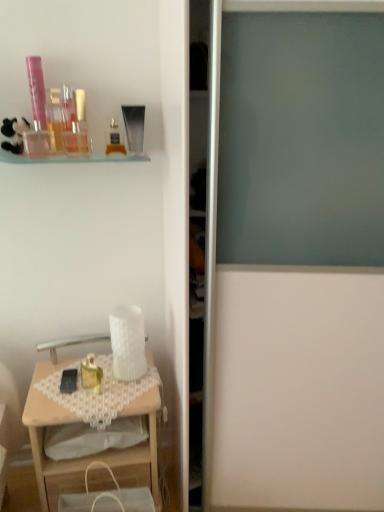
Identify the location of wooden desk at lower left. (87, 456).

Measure the distance between translucent glass perfume bottle at upper center, the 6th toiletry positioned from the top, and camera.

translucent glass perfume bottle at upper center, the 6th toiletry positioned from the top, and camera are 1.39 meters apart.

This screenshot has width=384, height=512. Identify the location of translucent glass perfume bottle at upper center, the 6th toiletry positioned from the top. (114, 139).

Where is `black matte mobile phone at lower left`? Image resolution: width=384 pixels, height=512 pixels. black matte mobile phone at lower left is located at coordinates (69, 381).

The image size is (384, 512). What are the coordinates of `white fabric handbag at lower left` in the screenshot? It's located at (107, 497).

Measure the distance between clear plastic bottle at upper left, marked as the second toiletry in a top-to-bottom arrangement, and camera.

A distance of 4.36 feet exists between clear plastic bottle at upper left, marked as the second toiletry in a top-to-bottom arrangement, and camera.

The width and height of the screenshot is (384, 512). What are the coordinates of `wooden desk at lower left` in the screenshot? It's located at (87, 456).

Is matte gold perfume at upper left, which is counted as the third toiletry, starting from the top, with matte plastic perfume bottle at upper left, placed as the seventh toiletry when sorted from top to bottom?

No.

From the image's perspective, which one is positioned higher, matte gold perfume at upper left, which is counted as the third toiletry, starting from the top, or matte plastic perfume bottle at upper left, placed as the seventh toiletry when sorted from top to bottom?

matte gold perfume at upper left, which is counted as the third toiletry, starting from the top, appears higher in the image.

Is matte gold perfume at upper left, which is the 6th toiletry from bottom to top, positioned with its back to matte plastic perfume bottle at upper left, placed as the seventh toiletry when sorted from top to bottom?

matte gold perfume at upper left, which is the 6th toiletry from bottom to top, is not turned away from matte plastic perfume bottle at upper left, placed as the seventh toiletry when sorted from top to bottom.

Is matte plastic perfume bottle at upper left, the 2th toiletry when ordered from bottom to top, located within matte gold perfume at upper left, which is counted as the third toiletry, starting from the top?

No, matte plastic perfume bottle at upper left, the 2th toiletry when ordered from bottom to top, is not a part of matte gold perfume at upper left, which is counted as the third toiletry, starting from the top.

Considering the relative sizes of pink plastic tube at upper left, which is the 8th toiletry from bottom to top, and matte plastic perfume bottle at upper left, the 2th toiletry when ordered from bottom to top, in the image provided, is pink plastic tube at upper left, which is the 8th toiletry from bottom to top, thinner than matte plastic perfume bottle at upper left, the 2th toiletry when ordered from bottom to top,?

Yes.

Who is shorter, pink plastic tube at upper left, which is the 8th toiletry from bottom to top, or matte plastic perfume bottle at upper left, placed as the seventh toiletry when sorted from top to bottom?

Standing shorter between the two is matte plastic perfume bottle at upper left, placed as the seventh toiletry when sorted from top to bottom.

How many degrees apart are the facing directions of pink plastic tube at upper left, which is the first toiletry in top-to-bottom order, and matte plastic perfume bottle at upper left, placed as the seventh toiletry when sorted from top to bottom?

There is a 4.36-degree angle between the facing directions of pink plastic tube at upper left, which is the first toiletry in top-to-bottom order, and matte plastic perfume bottle at upper left, placed as the seventh toiletry when sorted from top to bottom.

In the scene shown: From a real-world perspective, does pink plastic tube at upper left, which is the first toiletry in top-to-bottom order, stand above matte plastic perfume bottle at upper left, the 2th toiletry when ordered from bottom to top?

Yes, from a real-world perspective, pink plastic tube at upper left, which is the first toiletry in top-to-bottom order, is on top of matte plastic perfume bottle at upper left, the 2th toiletry when ordered from bottom to top.

Is black matte mobile phone at lower left looking in the opposite direction of matte gold perfume at upper left, which is the 6th toiletry from bottom to top?

No, black matte mobile phone at lower left's orientation is not away from matte gold perfume at upper left, which is the 6th toiletry from bottom to top.

Can you confirm if black matte mobile phone at lower left is bigger than matte gold perfume at upper left, which is counted as the third toiletry, starting from the top?

No.

Considering the sizes of objects black matte mobile phone at lower left and matte gold perfume at upper left, which is counted as the third toiletry, starting from the top, in the image provided, who is shorter, black matte mobile phone at lower left or matte gold perfume at upper left, which is counted as the third toiletry, starting from the top,?

Standing shorter between the two is black matte mobile phone at lower left.

From a real-world perspective, which object rests below the other?

From a 3D spatial view, black matte mobile phone at lower left is below.

Is point (68, 385) less distant than point (118, 140)?

That is False.

Is black matte mobile phone at lower left in contact with translucent glass perfume bottle at upper center, which is counted as the third toiletry, starting from the bottom?

No, black matte mobile phone at lower left is not next to translucent glass perfume bottle at upper center, which is counted as the third toiletry, starting from the bottom.

Is black matte mobile phone at lower left inside the boundaries of translucent glass perfume bottle at upper center, which is counted as the third toiletry, starting from the bottom, or outside?

black matte mobile phone at lower left lies outside translucent glass perfume bottle at upper center, which is counted as the third toiletry, starting from the bottom.

From the matte plastic perfume bottle at upper left, placed as the seventh toiletry when sorted from top to bottom, count 4th toiletrys backward and point to it. Please provide its 2D coordinates.

[(114, 139)]

Is translucent glass perfume bottle at upper center, which is counted as the third toiletry, starting from the bottom, not close to matte plastic perfume bottle at upper left, the 2th toiletry when ordered from bottom to top?

Actually, translucent glass perfume bottle at upper center, which is counted as the third toiletry, starting from the bottom, and matte plastic perfume bottle at upper left, the 2th toiletry when ordered from bottom to top, are a little close together.

Is translucent glass perfume bottle at upper center, which is counted as the third toiletry, starting from the bottom, behind matte plastic perfume bottle at upper left, placed as the seventh toiletry when sorted from top to bottom?

Yes, translucent glass perfume bottle at upper center, which is counted as the third toiletry, starting from the bottom, is behind matte plastic perfume bottle at upper left, placed as the seventh toiletry when sorted from top to bottom.

Is point (39, 145) in front of point (104, 457)?

Yes, it is in front of point (104, 457).

Which object is further away from the camera taking this photo, matte plastic perfume bottle at upper left, the 2th toiletry when ordered from bottom to top, or wooden desk at lower left?

wooden desk at lower left is further from the camera.

From the image's perspective, is matte plastic perfume bottle at upper left, placed as the seventh toiletry when sorted from top to bottom, located beneath wooden desk at lower left?

No.

Looking at this image, is matte plastic perfume bottle at upper left, placed as the seventh toiletry when sorted from top to bottom, positioned with its back to wooden desk at lower left?

No.

Would you say wooden desk at lower left contains clear plastic bottle at upper left, marked as the second toiletry in a top-to-bottom arrangement?

No, clear plastic bottle at upper left, marked as the second toiletry in a top-to-bottom arrangement, is located outside of wooden desk at lower left.

How different are the orientations of wooden desk at lower left and clear plastic bottle at upper left, marked as the second toiletry in a top-to-bottom arrangement, in degrees?

10.9 degrees separate the facing orientations of wooden desk at lower left and clear plastic bottle at upper left, marked as the second toiletry in a top-to-bottom arrangement.

From a real-world perspective, is wooden desk at lower left above or below clear plastic bottle at upper left, which ranks as the 7th toiletry in bottom-to-top order?

In terms of real-world spatial position, wooden desk at lower left is below clear plastic bottle at upper left, which ranks as the 7th toiletry in bottom-to-top order.

Does wooden desk at lower left lie behind clear plastic bottle at upper left, marked as the second toiletry in a top-to-bottom arrangement?

No, wooden desk at lower left is closer to the viewer.

You are a GUI agent. You are given a task and a screenshot of the screen. Output one action in this format:
    pyautogui.click(x=<x>, y=<y>)
    Task: Click on the 3rd toiletry in front of the matte gold perfume at upper left, which is the 6th toiletry from bottom to top, counting from the anchor's position
    This screenshot has height=512, width=384.
    Given the screenshot: What is the action you would take?
    pyautogui.click(x=39, y=143)

From a real-world perspective, which toiletry is the 6th one underneath the pink plastic tube at upper left, which is the first toiletry in top-to-bottom order? Please provide its 2D coordinates.

[(39, 143)]

Considering their positions, is translucent glass perfume bottle at upper center, the 6th toiletry positioned from the top, positioned closer to clear plastic bottle at upper left, marked as the second toiletry in a top-to-bottom arrangement, than gold metallic perfume at lower left, placed as the first toiletry when sorted from bottom to top?

The object closer to clear plastic bottle at upper left, marked as the second toiletry in a top-to-bottom arrangement, is translucent glass perfume bottle at upper center, the 6th toiletry positioned from the top.

Considering their positions, is white fabric handbag at lower left positioned further to wooden desk at lower left than matte gold perfume at upper left, which is counted as the third toiletry, starting from the top?

The object further to wooden desk at lower left is matte gold perfume at upper left, which is counted as the third toiletry, starting from the top.

Based on their spatial positions, is wooden desk at lower left or matte plastic perfume bottle at upper left, the 2th toiletry when ordered from bottom to top, further from gold metallic perfume at lower left, which is the 8th toiletry in top-to-bottom order?

matte plastic perfume bottle at upper left, the 2th toiletry when ordered from bottom to top, is further to gold metallic perfume at lower left, which is the 8th toiletry in top-to-bottom order.

Which object lies further to the anchor point translucent plastic container at upper left, which is the fifth toiletry in top-to-bottom order, matte gold perfume at upper left, which is counted as the third toiletry, starting from the top, or matte plastic perfume bottle at upper left, placed as the seventh toiletry when sorted from top to bottom?

matte plastic perfume bottle at upper left, placed as the seventh toiletry when sorted from top to bottom, lies further to translucent plastic container at upper left, which is the fifth toiletry in top-to-bottom order, than the other object.

Looking at the image, which one is located further to wooden desk at lower left, matte gold perfume at upper left, which is counted as the third toiletry, starting from the top, or matte plastic perfume bottle at upper left, placed as the seventh toiletry when sorted from top to bottom?

matte gold perfume at upper left, which is counted as the third toiletry, starting from the top, is further to wooden desk at lower left.

Which object lies further to the anchor point translucent plastic container at upper left, which is the fifth toiletry in top-to-bottom order, translucent glass perfume bottle at upper center, which is counted as the third toiletry, starting from the bottom, or wooden desk at lower left?

wooden desk at lower left is further to translucent plastic container at upper left, which is the fifth toiletry in top-to-bottom order.

From the image, which object appears to be nearer to pink plastic tube at upper left, which is the first toiletry in top-to-bottom order, translucent plastic container at upper left, which is the fifth toiletry in top-to-bottom order, or wooden desk at lower left?

translucent plastic container at upper left, which is the fifth toiletry in top-to-bottom order, is positioned closer to the anchor pink plastic tube at upper left, which is the first toiletry in top-to-bottom order.

When comparing their distances from translucent plastic container at upper left, arranged as the 4th toiletry when ordered from the bottom, does clear plastic bottle at upper left, marked as the second toiletry in a top-to-bottom arrangement, or matte gold perfume at upper left, which is counted as the third toiletry, starting from the top, seem closer?

clear plastic bottle at upper left, marked as the second toiletry in a top-to-bottom arrangement, is closer to translucent plastic container at upper left, arranged as the 4th toiletry when ordered from the bottom.

Identify the location of toiletry between matte plastic perfume bottle at upper left, the 2th toiletry when ordered from bottom to top, and wooden desk at lower left in the up-down direction. Image resolution: width=384 pixels, height=512 pixels. click(91, 374).

Where is `screen door between pink plastic tube at upper left, which is the first toiletry in top-to-bottom order, and white fabric handbag at lower left vertically`? This screenshot has height=512, width=384. screen door between pink plastic tube at upper left, which is the first toiletry in top-to-bottom order, and white fabric handbag at lower left vertically is located at coordinates (299, 389).

At what (x,y) coordinates should I click in order to perform the action: click on desk between matte plastic perfume bottle at upper left, placed as the seventh toiletry when sorted from top to bottom, and white fabric handbag at lower left vertically. Please return your answer as a coordinate pair (x, y). Image resolution: width=384 pixels, height=512 pixels. Looking at the image, I should click on (87, 456).

Locate an element on the screen. desk between black matte mobile phone at lower left and white fabric handbag at lower left in the up-down direction is located at coordinates (87, 456).